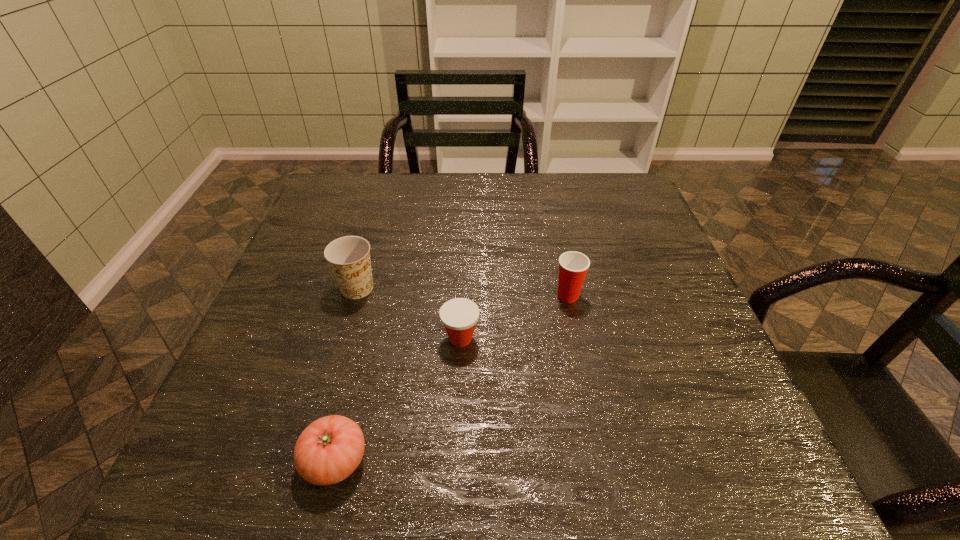
This screenshot has height=540, width=960. I want to click on vacant space that satisfies the following two spatial constraints: 1. on the front side of the rightmost Dixie cup; 2. on the right side of the leftmost Dixie cup, so click(355, 295).

Locate an element on the screen. This screenshot has height=540, width=960. free space that satisfies the following two spatial constraints: 1. on the front side of the leftmost Dixie cup; 2. on the left side of the second Dixie cup from right to left is located at coordinates (343, 339).

Locate an element on the screen. This screenshot has width=960, height=540. vacant point that satisfies the following two spatial constraints: 1. on the back side of the nearest object; 2. on the left side of the rightmost Dixie cup is located at coordinates (375, 295).

This screenshot has width=960, height=540. Identify the location of free spot that satisfies the following two spatial constraints: 1. on the front side of the leftmost Dixie cup; 2. on the right side of the rightmost Dixie cup. (355, 295).

At what (x,y) coordinates should I click in order to perform the action: click on vacant space that satisfies the following two spatial constraints: 1. on the back side of the second Dixie cup from left to right; 2. on the left side of the nearest object. Please return your answer as a coordinate pair (x, y). Looking at the image, I should click on (365, 339).